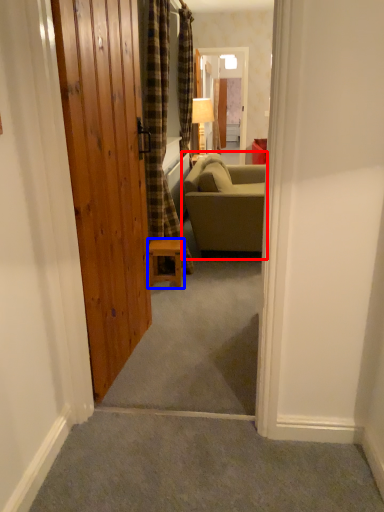
Question: Which point is further to the camera, studio couch (highlighted by a red box) or furniture (highlighted by a blue box)?

Choices:
 (A) studio couch
 (B) furniture

Answer: (A)